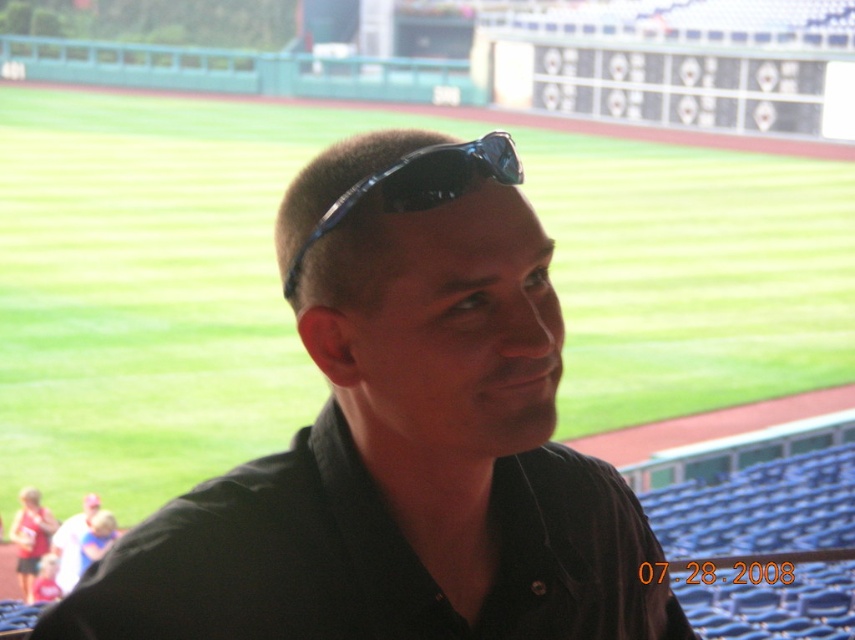
You are standing at the point closer to the camera in the image. Which point are you at, point (487, 134) or point (352, 301)?

You are at point (487, 134) because it is closer to the camera than point (352, 301).

What are the coordinates of the black matte shirt at center?

The black matte shirt at center is located at coordinates point (401,440).

You are standing at the edge of the baseball field and see the black matte shirt at center. If you want to throw a baseball to hit the shirt, and you know that the average throwing distance for an adult is about 10 feet, will you be able to reach it?

The black matte shirt at center is 12.61 feet away from the viewer. Since the average throwing distance is about 10 feet, you would not be able to reach it with a throw.